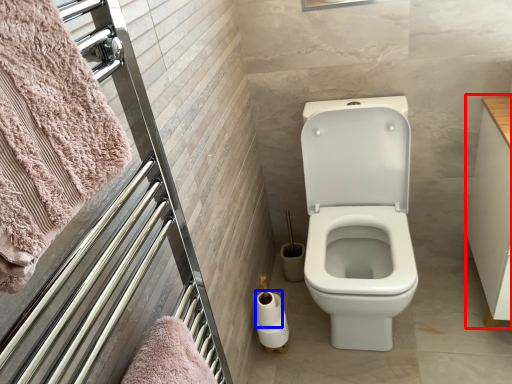
Question: Among these objects, which one is farthest to the camera, drawer (highlighted by a red box) or toilet paper (highlighted by a blue box)?

Choices:
 (A) drawer
 (B) toilet paper

Answer: (B)